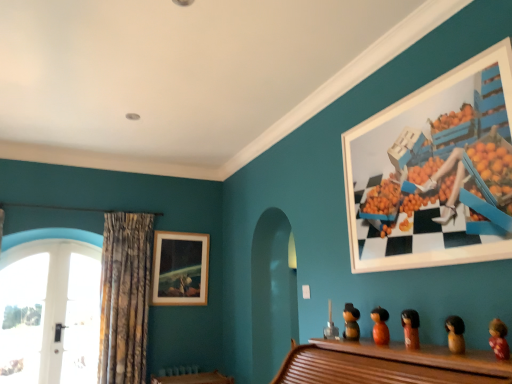
Locate an element on the screen. empty space that is ontop of wooden picture frame at upper center, marked as the 1th picture frame in a back-to-front arrangement (from a real-world perspective) is located at coordinates (179, 232).